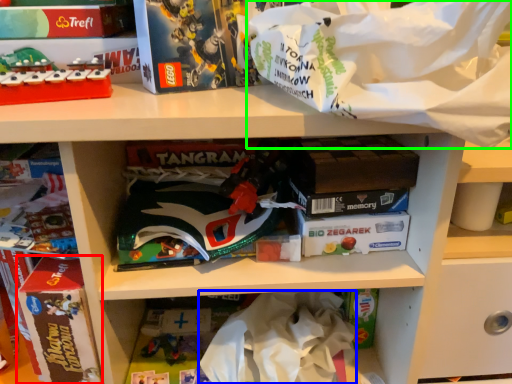
Question: Considering the real-world distances, which object is farthest from paperback book (highlighted by a red box)? clothing (highlighted by a blue box) or material (highlighted by a green box)?

Choices:
 (A) clothing
 (B) material

Answer: (B)